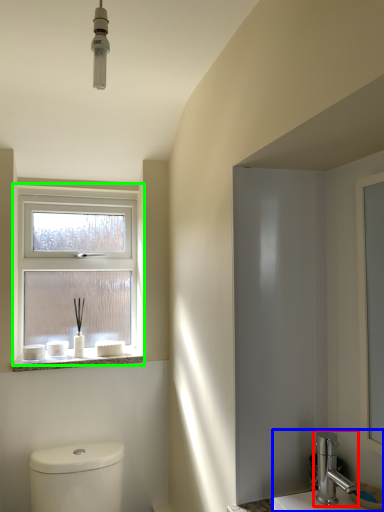
Question: Estimate the real-world distances between objects in this image. Which object is closer to tap (highlighted by a red box), sink (highlighted by a blue box) or window (highlighted by a green box)?

Choices:
 (A) sink
 (B) window

Answer: (A)